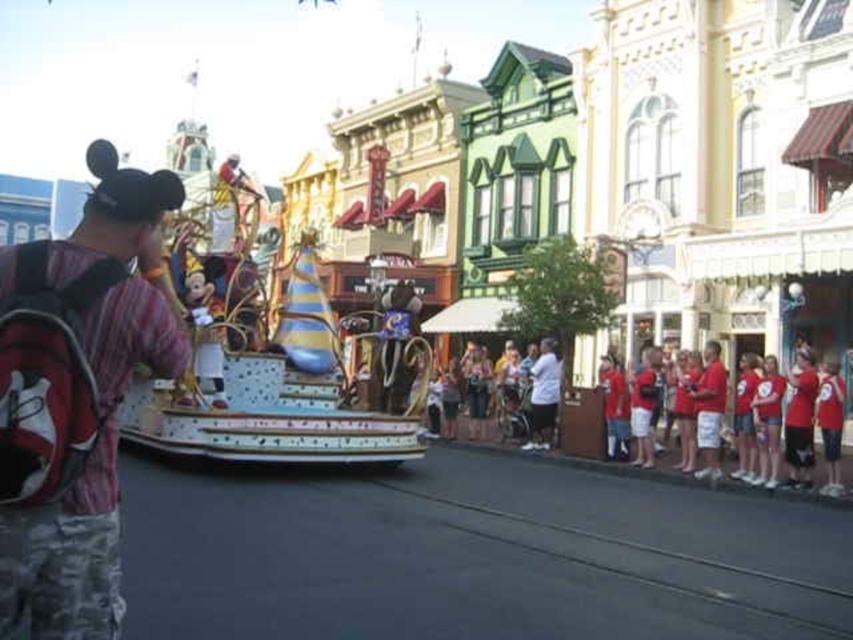
Consider the image. Is striped cotton shirt at left in front of red cotton t-shirts at lower right?

Yes, striped cotton shirt at left is closer to the viewer.

Looking at this image, does striped cotton shirt at left appear on the right side of red cotton t-shirts at lower right?

No, striped cotton shirt at left is not to the right of red cotton t-shirts at lower right.

Which is in front, point (0, 445) or point (567, 460)?

Point (0, 445)

The height and width of the screenshot is (640, 853). What are the coordinates of `striped cotton shirt at left` in the screenshot? It's located at (76, 400).